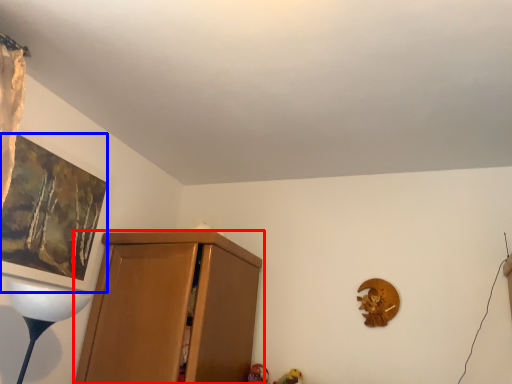
Question: Which of the following is the farthest to the observer, cupboard (highlighted by a red box) or picture frame (highlighted by a blue box)?

Choices:
 (A) cupboard
 (B) picture frame

Answer: (A)